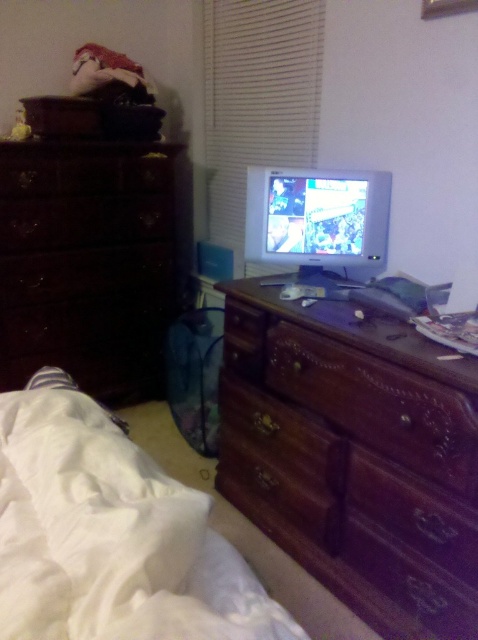
Question: Among these points, which one is nearest to the camera?

Choices:
 (A) (322, 38)
 (B) (456, 420)
 (C) (303, 348)

Answer: (B)

Question: Based on their relative distances, which object is farther from the dark wood dresser at left?

Choices:
 (A) wooden drawer at center
 (B) white matte blinds at upper center
 (C) mahogany wood dresser at center
 (D) white soft bed at lower left

Answer: (D)

Question: Does white soft bed at lower left appear on the right side of dark wood dresser at left?

Choices:
 (A) yes
 (B) no

Answer: (A)

Question: Among these objects, which one is nearest to the camera?

Choices:
 (A) white matte blinds at upper center
 (B) mahogany wood dresser at center

Answer: (B)

Question: Does mahogany wood dresser at center appear on the left side of white soft bed at lower left?

Choices:
 (A) yes
 (B) no

Answer: (B)

Question: Does mahogany wood dresser at center appear on the left side of dark wood dresser at left?

Choices:
 (A) no
 (B) yes

Answer: (A)